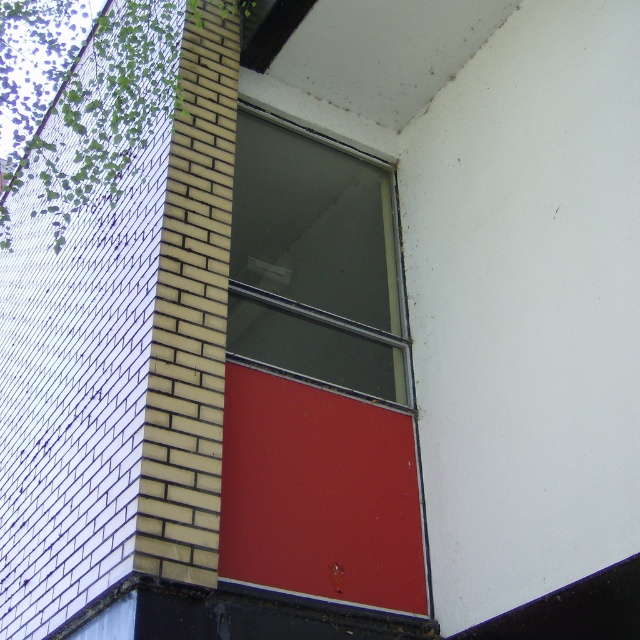
Question: Can you confirm if matte red door at center is positioned above transparent glass window at center?

Choices:
 (A) yes
 (B) no

Answer: (B)

Question: Can you confirm if matte red door at center is thinner than transparent glass window at center?

Choices:
 (A) yes
 (B) no

Answer: (A)

Question: Is matte red door at center above transparent glass window at center?

Choices:
 (A) yes
 (B) no

Answer: (B)

Question: Which object appears farthest from the camera in this image?

Choices:
 (A) transparent glass window at center
 (B) matte red door at center

Answer: (A)

Question: Which point appears closest to the camera in this image?

Choices:
 (A) (369, 244)
 (B) (394, 474)

Answer: (B)